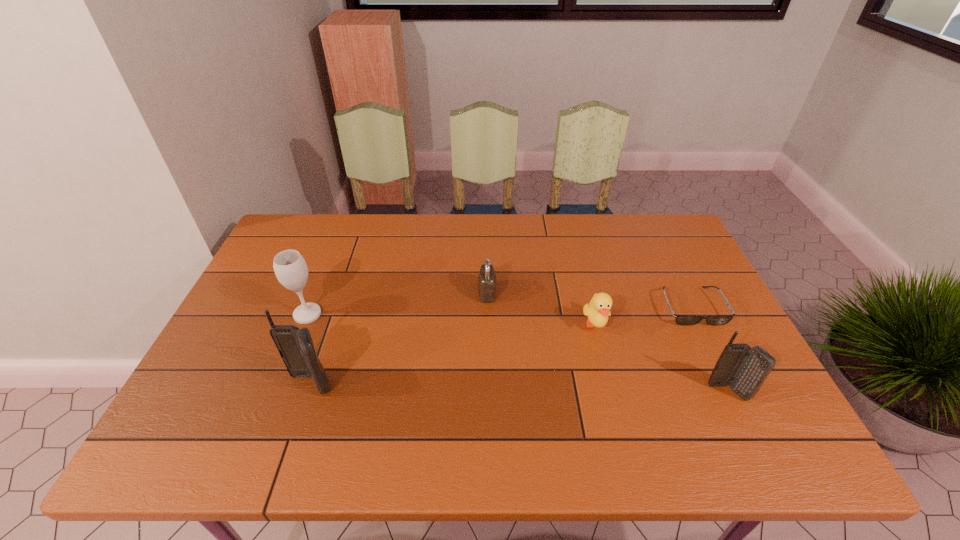
Locate an element on the screen. Image resolution: width=960 pixels, height=540 pixels. vacant region at the far left corner of the desktop is located at coordinates (300, 219).

In the image, there is a desktop. Identify the location of free space at the near left corner. The width and height of the screenshot is (960, 540). (216, 399).

In the image, there is a desktop. At what (x,y) coordinates should I click in order to perform the action: click on vacant space at the far right corner. Please return your answer as a coordinate pair (x, y). Looking at the image, I should click on (649, 252).

This screenshot has height=540, width=960. Find the location of `vacant area between the duckling and the padlock`. vacant area between the duckling and the padlock is located at coordinates (541, 309).

Find the location of a particular element. The image size is (960, 540). free point between the wineglass and the sunglasses is located at coordinates (499, 310).

This screenshot has height=540, width=960. Identify the location of free spot between the fourth object from right to left and the wineglass. (397, 303).

Find the location of a particular element. vacant space in between the taller cellular telephone and the padlock is located at coordinates (398, 339).

Where is `vacant region between the wineglass and the fourth object from left to right`? This screenshot has width=960, height=540. vacant region between the wineglass and the fourth object from left to right is located at coordinates (451, 320).

Locate an element on the screen. The height and width of the screenshot is (540, 960). free space between the third object from right to left and the sunglasses is located at coordinates (643, 316).

At what (x,y) coordinates should I click in order to perform the action: click on empty space that is in between the wineglass and the shorter cellular telephone. Please return your answer as a coordinate pair (x, y). Looking at the image, I should click on (517, 353).